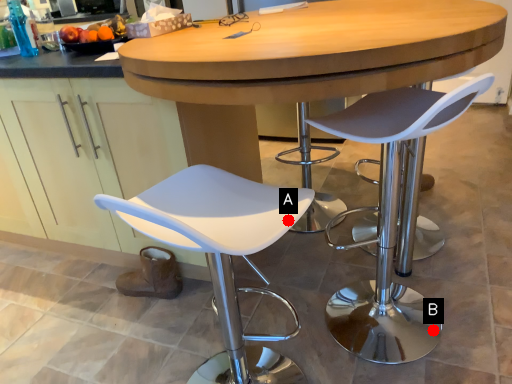
Question: Two points are circled on the image, labeled by A and B beside each circle. Which point is closer to the camera?

Choices:
 (A) A is closer
 (B) B is closer

Answer: (A)